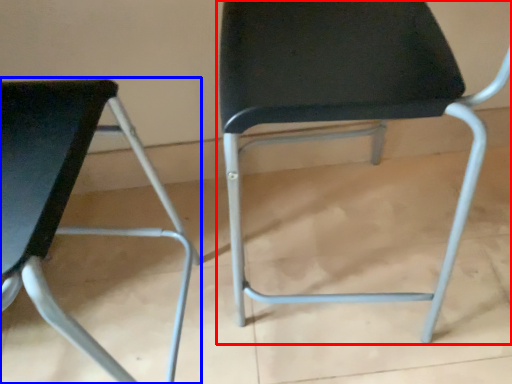
Question: Among these objects, which one is farthest to the camera, chair (highlighted by a red box) or chair (highlighted by a blue box)?

Choices:
 (A) chair
 (B) chair

Answer: (A)